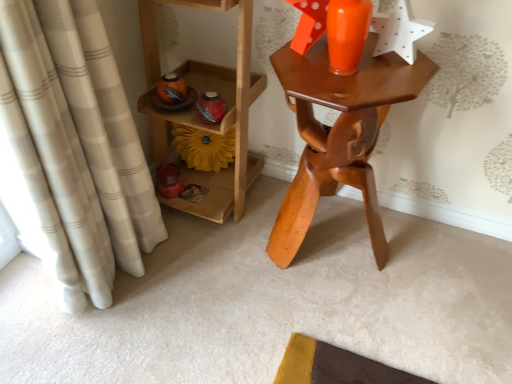
Find the location of `vacant space that is in between beige plaid curtain at left and wooden shelf at left`. vacant space that is in between beige plaid curtain at left and wooden shelf at left is located at coordinates (183, 266).